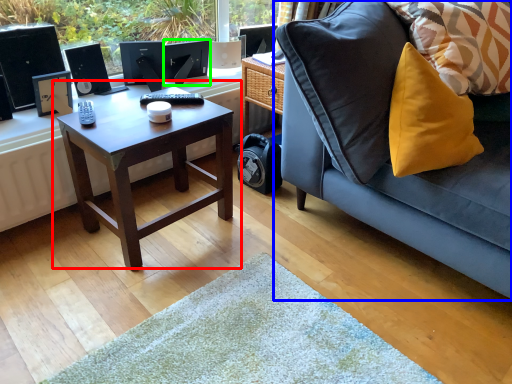
Question: Which object is positioned closest to coffee table (highlighted by a red box)? Select from studio couch (highlighted by a blue box) and computer monitor (highlighted by a green box).

Choices:
 (A) studio couch
 (B) computer monitor

Answer: (A)